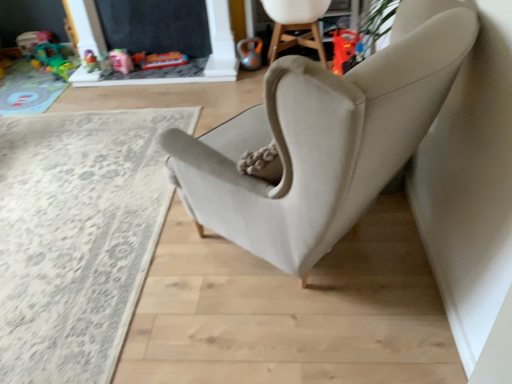
Question: In the image, is orange metallic kettlebell at upper center, arranged as the 5th toy when viewed from the left, positioned in front of or behind black chalkboard at upper center?

Choices:
 (A) behind
 (B) front

Answer: (A)

Question: In terms of size, does orange metallic kettlebell at upper center, arranged as the 5th toy when viewed from the left, appear bigger or smaller than black chalkboard at upper center?

Choices:
 (A) small
 (B) big

Answer: (A)

Question: Estimate the real-world distances between objects in this image. Which object is farther from the beige carpet at lower left?

Choices:
 (A) black chalkboard at upper center
 (B) orange metallic kettlebell at upper center, which ranks as the first toy in right-to-left order
 (C) translucent plastic toy at upper left, which is the 2th toy from left to right
 (D) plastic pink toy at upper left, placed as the 5th toy when sorted from right to left
 (E) plastic toy car at upper center, positioned as the second toy in right-to-left order

Answer: (D)

Question: Estimate the real-world distances between objects in this image. Which object is farther from the suede beige armchair at upper center?

Choices:
 (A) translucent plastic toy at upper left, which is the fourth toy from right to left
 (B) plastic pink toy at upper left, the first toy viewed from the left
 (C) black chalkboard at upper center
 (D) orange metallic kettlebell at upper center, arranged as the 5th toy when viewed from the left
 (E) plastic toy car at upper center, positioned as the second toy in right-to-left order

Answer: (B)